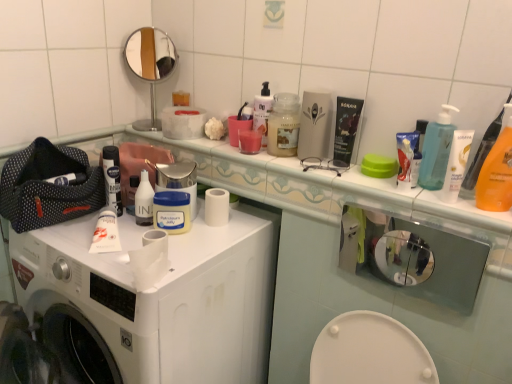
In order to click on free space to the left of white glossy lotion at upper right, marked as the 1th toiletry in a front-to-back arrangement in this screenshot , I will do `click(392, 198)`.